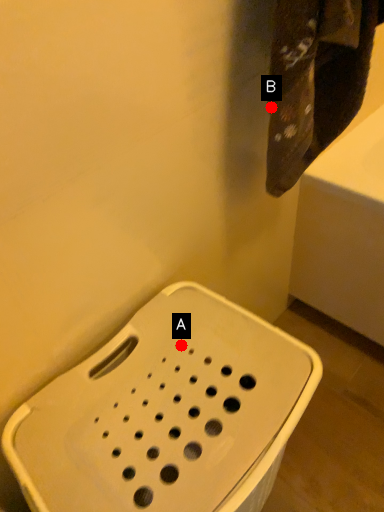
Question: Two points are circled on the image, labeled by A and B beside each circle. Which point is farther from the camera taking this photo?

Choices:
 (A) A is further
 (B) B is further

Answer: (A)